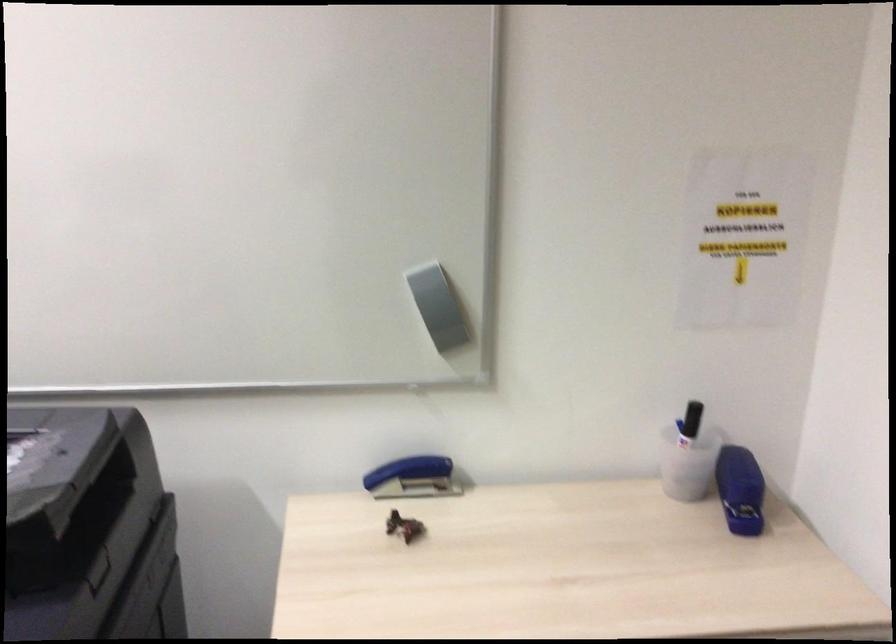
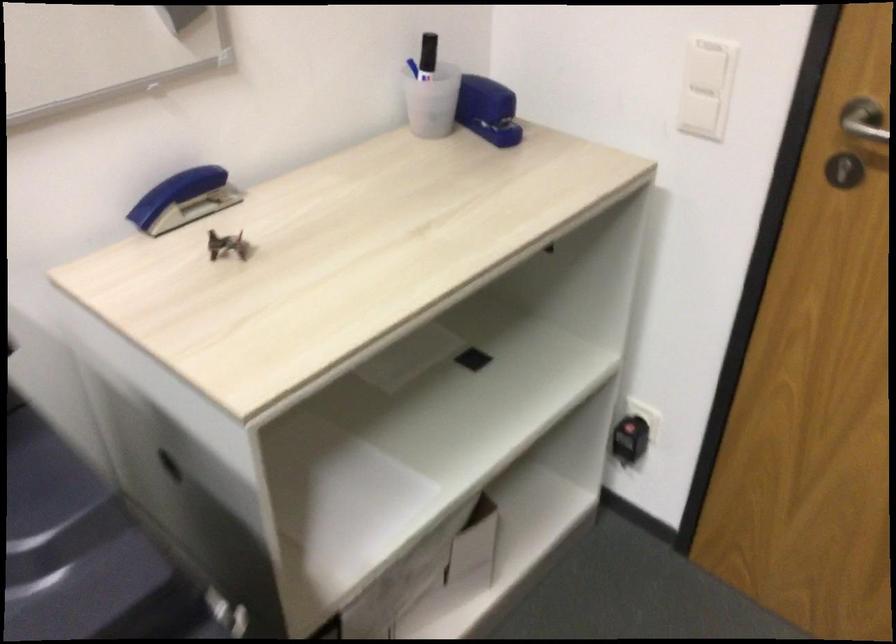
Find the pixel in the second image that matches point (736, 488) in the first image.

(487, 109)